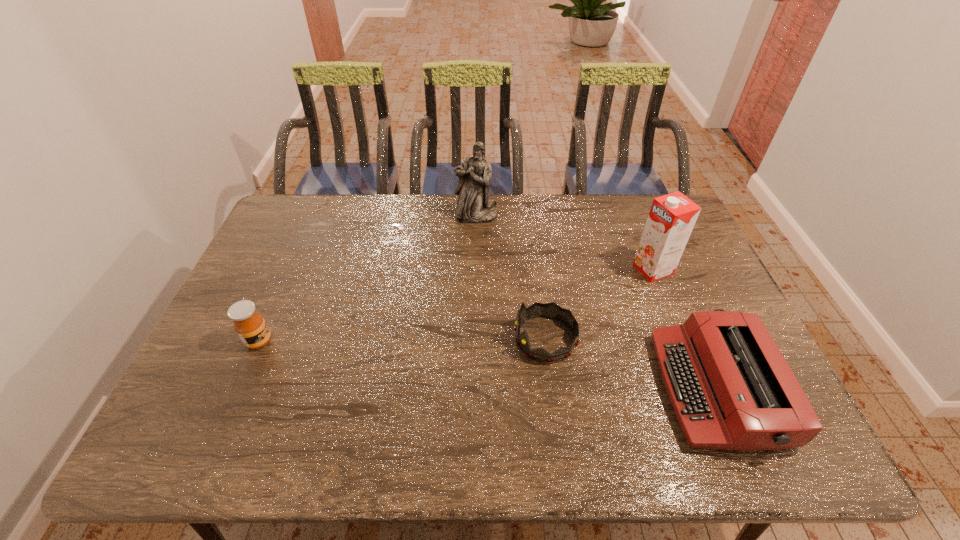
Find the location of a particular element. Image resolution: width=960 pixels, height=540 pixels. the fourth object from right to left is located at coordinates (474, 206).

Locate an element on the screen. The height and width of the screenshot is (540, 960). the farthest object is located at coordinates (474, 206).

Locate an element on the screen. The height and width of the screenshot is (540, 960). the fourth nearest object is located at coordinates (671, 219).

This screenshot has height=540, width=960. What are the coordinates of `the leftmost object` in the screenshot? It's located at (250, 326).

Identify the location of tiara. Image resolution: width=960 pixels, height=540 pixels. (550, 310).

The width and height of the screenshot is (960, 540). What are the coordinates of `typewriter` in the screenshot? It's located at tap(731, 388).

Identify the location of vacant space located on the front-facing side of the fourth object from right to left. The width and height of the screenshot is (960, 540). (476, 275).

I want to click on free space located on the right of the carton, so click(x=704, y=269).

Locate an element on the screen. free space located on the front-facing side of the honey is located at coordinates (399, 341).

Locate an element on the screen. free space located at the front of the third object from right to left with jewels is located at coordinates (383, 339).